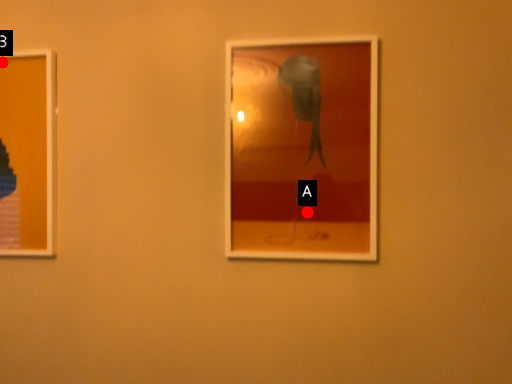
Question: Two points are circled on the image, labeled by A and B beside each circle. Which of the following is the closest to the observer?

Choices:
 (A) A is closer
 (B) B is closer

Answer: (A)